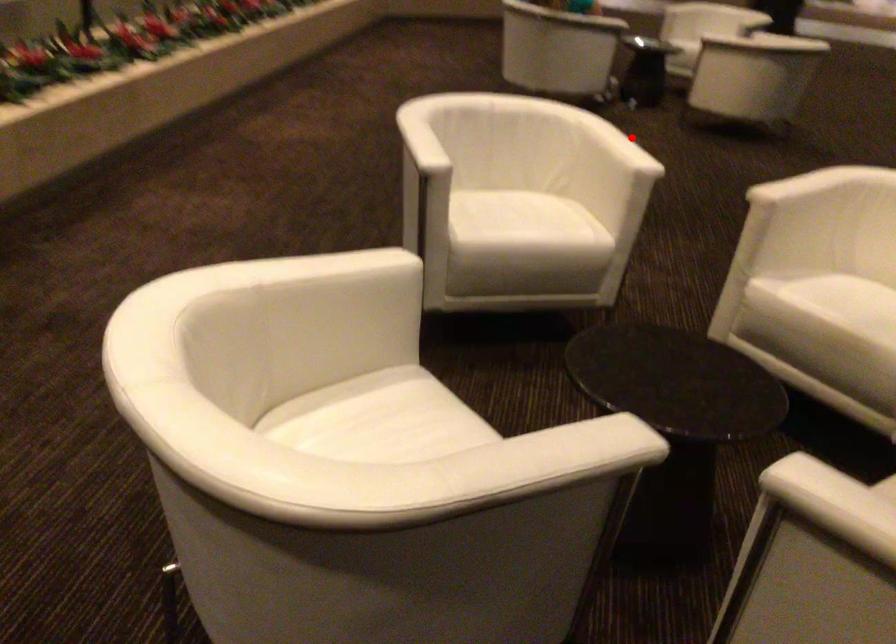
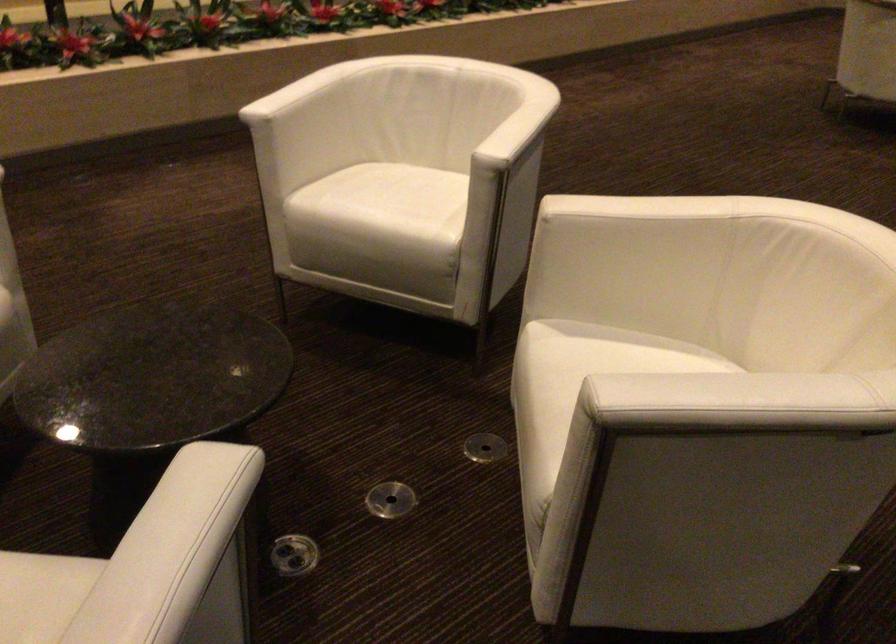
Question: I am providing you with two images of the same scene from different viewpoints. In image1, a red point is highlighted. Considering the same 3D point in image2, which of the following is correct?

Choices:
 (A) It is closer
 (B) It is farther

Answer: (A)